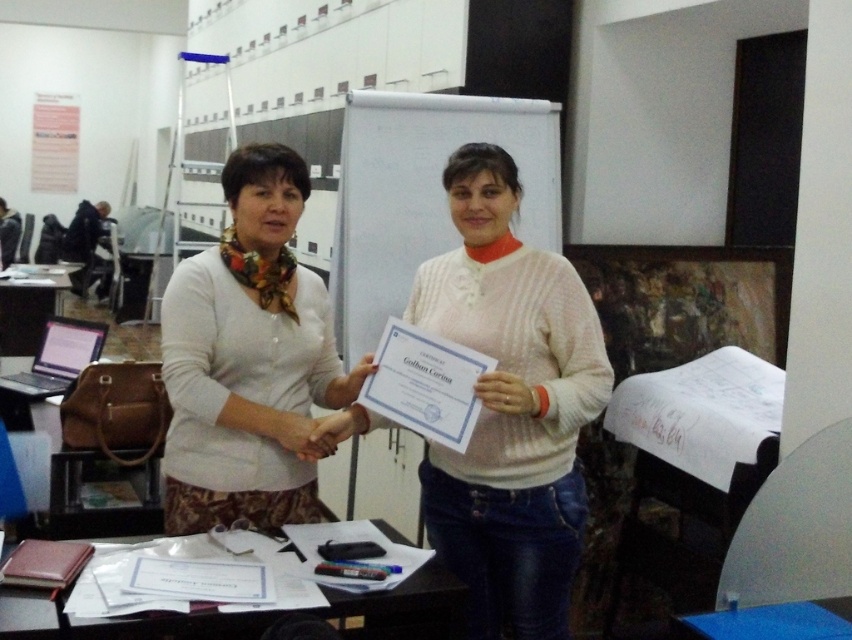
Who is higher up, white knitted sweater at center or white paper at lower center?

white knitted sweater at center is higher up.

Between point (338, 412) and point (364, 595), which one is positioned behind?

The point (338, 412) is more distant.

The height and width of the screenshot is (640, 852). Identify the location of white knitted sweater at center. (510, 406).

Which is more to the left, white knitted sweater at center or blue plastic table at lower center?

white knitted sweater at center

Can you confirm if white knitted sweater at center is smaller than blue plastic table at lower center?

Actually, white knitted sweater at center might be larger than blue plastic table at lower center.

Which is behind, point (579, 486) or point (793, 627)?

Point (579, 486)

This screenshot has height=640, width=852. I want to click on white knitted sweater at center, so click(x=510, y=406).

Is the position of white paper at lower center less distant than that of blue plastic table at lower center?

Yes.

Which of these two, white paper at lower center or blue plastic table at lower center, stands shorter?

blue plastic table at lower center

Between point (340, 604) and point (729, 628), which one is positioned in front?

Point (729, 628) is in front.

Identify the location of white paper at lower center. The height and width of the screenshot is (640, 852). (312, 612).